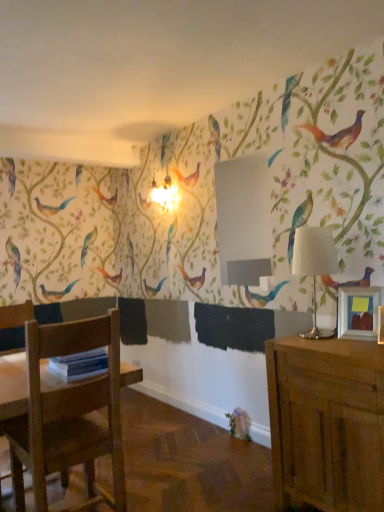
Question: Does white fabric lampshade at right have a smaller size compared to wooden cabinet at right?

Choices:
 (A) yes
 (B) no

Answer: (A)

Question: Is white fabric lampshade at right beside wooden cabinet at right?

Choices:
 (A) no
 (B) yes

Answer: (A)

Question: Does white fabric lampshade at right have a greater width compared to wooden cabinet at right?

Choices:
 (A) yes
 (B) no

Answer: (B)

Question: Does white fabric lampshade at right have a larger size compared to wooden cabinet at right?

Choices:
 (A) no
 (B) yes

Answer: (A)

Question: Does white fabric lampshade at right have a lesser width compared to wooden cabinet at right?

Choices:
 (A) yes
 (B) no

Answer: (A)

Question: Does white fabric lampshade at right appear on the left side of wooden cabinet at right?

Choices:
 (A) no
 (B) yes

Answer: (B)

Question: Could you tell me if wooden chair at lower left is turned towards wooden picture frame at right?

Choices:
 (A) yes
 (B) no

Answer: (B)

Question: Is the depth of wooden chair at lower left less than that of wooden picture frame at right?

Choices:
 (A) no
 (B) yes

Answer: (B)

Question: Is wooden chair at lower left positioned far away from wooden picture frame at right?

Choices:
 (A) yes
 (B) no

Answer: (A)

Question: Is wooden chair at lower left to the right of wooden picture frame at right from the viewer's perspective?

Choices:
 (A) yes
 (B) no

Answer: (B)

Question: Does wooden chair at lower left have a larger size compared to wooden picture frame at right?

Choices:
 (A) no
 (B) yes

Answer: (B)

Question: Is wooden chair at lower left smaller than wooden picture frame at right?

Choices:
 (A) yes
 (B) no

Answer: (B)

Question: Is wooden picture frame at right thinner than wooden chair at lower left?

Choices:
 (A) no
 (B) yes

Answer: (B)